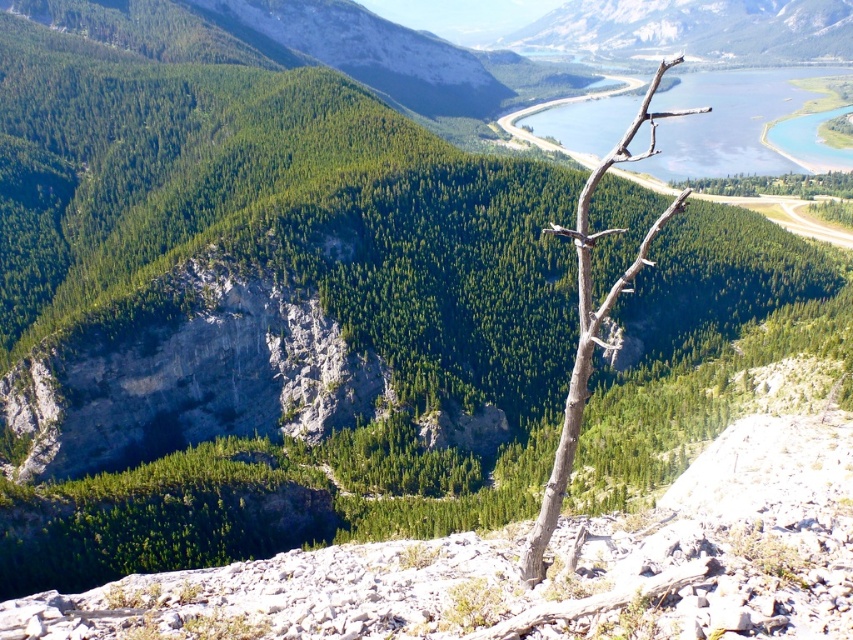
Which is above, blue water at upper right or green forested mountain at upper right?

Positioned higher is green forested mountain at upper right.

Can you confirm if blue water at upper right is positioned to the left of green forested mountain at upper right?

Correct, you'll find blue water at upper right to the left of green forested mountain at upper right.

Which is behind, point (689, 77) or point (679, 36)?

The point (679, 36) is more distant.

The width and height of the screenshot is (853, 640). In order to click on blue water at upper right in this screenshot , I will do `click(724, 122)`.

Does green forested mountain at upper right have a greater height compared to brown rough branch at center?

No.

Which is in front, point (798, 26) or point (572, 381)?

Point (572, 381)

Who is more distant from viewer, [647,3] or [556,452]?

The point [647,3] is more distant.

Identify the location of green forested mountain at upper right. (x=694, y=28).

From the picture: Is blue water at upper right below brown rough branch at center?

No, blue water at upper right is not below brown rough branch at center.

Does blue water at upper right have a lesser height compared to brown rough branch at center?

Yes, blue water at upper right is shorter than brown rough branch at center.

Does point (556, 131) come behind point (567, 449)?

Yes, point (556, 131) is farther from viewer.

Locate an element on the screen. This screenshot has height=640, width=853. blue water at upper right is located at coordinates (724, 122).